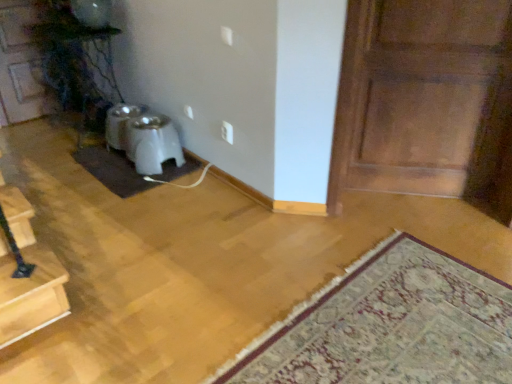
I want to click on wooden panel door at right, marked as the 1th door in a front-to-back arrangement, so click(x=422, y=97).

Image resolution: width=512 pixels, height=384 pixels. Identify the location of wooden door at upper left, which is the second door from front to back. (20, 65).

In order to click on door lying on the left of white plastic electric outlet at center in this screenshot , I will do `click(20, 65)`.

Based on the photo, between wooden door at upper left, arranged as the first door when viewed from the back, and white plastic electric outlet at center, which one has larger size?

Bigger between the two is wooden door at upper left, arranged as the first door when viewed from the back.

Does wooden door at upper left, arranged as the first door when viewed from the back, contain white plastic electric outlet at center?

Definitely not — white plastic electric outlet at center is not inside wooden door at upper left, arranged as the first door when viewed from the back.

Which is more to the left, wooden door at upper left, which is the 2th door from right to left, or white plastic electric outlet at center?

From the viewer's perspective, wooden door at upper left, which is the 2th door from right to left, appears more on the left side.

Is white plastic pet feeder at center aimed at carpeted rug at lower right?

No, white plastic pet feeder at center does not turn towards carpeted rug at lower right.

What's the angular difference between white plastic pet feeder at center and carpeted rug at lower right's facing directions?

They differ by 86.6 degrees in their facing directions.

Considering the points (130, 128) and (298, 382), which point is in front, point (130, 128) or point (298, 382)?

The point (298, 382) is closer to the camera.

Considering the relative sizes of white plastic pet feeder at center and carpeted rug at lower right in the image provided, is white plastic pet feeder at center shorter than carpeted rug at lower right?

No, white plastic pet feeder at center is not shorter than carpeted rug at lower right.

Is point (230, 125) positioned before point (183, 161)?

Yes, it is.

From the image's perspective, between white plastic electric outlet at center and white plastic pet feeder at center, which one is located above?

white plastic electric outlet at center, from the image's perspective.

Is white plastic electric outlet at center thinner than white plastic pet feeder at center?

Yes, white plastic electric outlet at center is thinner than white plastic pet feeder at center.

Can you tell me how much white plastic electric outlet at center and white plastic pet feeder at center differ in facing direction?

There is a 0.00553-degree angle between the facing directions of white plastic electric outlet at center and white plastic pet feeder at center.

From a real-world perspective, is brown felt doormat at lower left on wooden door at upper left, which is the second door from front to back?

No, from a real-world perspective, brown felt doormat at lower left is not above wooden door at upper left, which is the second door from front to back.

Does brown felt doormat at lower left turn towards wooden door at upper left, arranged as the first door when viewed from the back?

No, brown felt doormat at lower left does not turn towards wooden door at upper left, arranged as the first door when viewed from the back.

From the image's perspective, between brown felt doormat at lower left and wooden door at upper left, which is the 2th door from right to left, which one is located above?

wooden door at upper left, which is the 2th door from right to left, from the image's perspective.

Is wooden door at upper left, arranged as the first door when viewed from the back, not near carpeted rug at lower right?

Indeed, wooden door at upper left, arranged as the first door when viewed from the back, is not near carpeted rug at lower right.

Is wooden door at upper left, the 1th door from the left, taller or shorter than carpeted rug at lower right?

In the image, wooden door at upper left, the 1th door from the left, appears to be taller than carpeted rug at lower right.

Which of these two, wooden door at upper left, arranged as the first door when viewed from the back, or carpeted rug at lower right, is thinner?

Thinner between the two is wooden door at upper left, arranged as the first door when viewed from the back.

Relative to carpeted rug at lower right, is wooden door at upper left, which is the second door from front to back, in front or behind?

Clearly, wooden door at upper left, which is the second door from front to back, is behind carpeted rug at lower right.

Does carpeted rug at lower right have a greater height compared to brown felt doormat at lower left?

Incorrect, the height of carpeted rug at lower right is not larger of that of brown felt doormat at lower left.

From a real-world perspective, which is physically below, carpeted rug at lower right or brown felt doormat at lower left?

From a 3D spatial view, brown felt doormat at lower left is below.

Does carpeted rug at lower right have a lesser width compared to brown felt doormat at lower left?

Incorrect, the width of carpeted rug at lower right is not less than that of brown felt doormat at lower left.

Would you say white plastic electric outlet at center is a long distance from wooden panel door at right, marked as the 1th door in a front-to-back arrangement?

Yes, white plastic electric outlet at center and wooden panel door at right, marked as the 1th door in a front-to-back arrangement, are located far from each other.

In the scene shown: Between white plastic electric outlet at center and wooden panel door at right, marked as the 1th door in a front-to-back arrangement, which one has smaller size?

Smaller between the two is white plastic electric outlet at center.

Considering the relative sizes of white plastic electric outlet at center and wooden panel door at right, marked as the 1th door in a front-to-back arrangement, in the image provided, is white plastic electric outlet at center taller than wooden panel door at right, marked as the 1th door in a front-to-back arrangement,?

No.

Find the location of a particular element. Image resolution: width=512 pixels, height=384 pixels. electric outlet below the wooden door at upper left, the 1th door from the left (from the image's perspective) is located at coordinates (227, 132).

This screenshot has width=512, height=384. In order to click on mat below the white plastic pet feeder at center (from a real-world perspective) in this screenshot , I will do `click(389, 326)`.

Estimate the real-world distances between objects in this image. Which object is closer to white plastic electric outlet at center, wooden door at upper left, arranged as the first door when viewed from the back, or wooden panel door at right, marked as the 2th door in a back-to-front arrangement?

wooden panel door at right, marked as the 2th door in a back-to-front arrangement, lies closer to white plastic electric outlet at center than the other object.

Estimate the real-world distances between objects in this image. Which object is further from carpeted rug at lower right, brown felt doormat at lower left or wooden door at upper left, which is the second door from front to back?

wooden door at upper left, which is the second door from front to back, is further to carpeted rug at lower right.

Considering their positions, is wooden panel door at right, marked as the 2th door in a back-to-front arrangement, positioned closer to brown felt doormat at lower left than carpeted rug at lower right?

The object closer to brown felt doormat at lower left is wooden panel door at right, marked as the 2th door in a back-to-front arrangement.

From the image, which object appears to be farther from wooden door at upper left, arranged as the first door when viewed from the back, white plastic pet feeder at center or carpeted rug at lower right?

The object further to wooden door at upper left, arranged as the first door when viewed from the back, is carpeted rug at lower right.

In the scene shown: Estimate the real-world distances between objects in this image. Which object is closer to carpeted rug at lower right, wooden panel door at right, the 2th door in the left-to-right sequence, or white plastic electric outlet at center?

wooden panel door at right, the 2th door in the left-to-right sequence, lies closer to carpeted rug at lower right than the other object.

Looking at the image, which one is located further to brown felt doormat at lower left, white plastic electric outlet at center or wooden panel door at right, the 2th door in the left-to-right sequence?

wooden panel door at right, the 2th door in the left-to-right sequence, is further to brown felt doormat at lower left.

Estimate the real-world distances between objects in this image. Which object is closer to carpeted rug at lower right, white plastic pet feeder at center or white plastic electric outlet at center?

white plastic electric outlet at center is positioned closer to the anchor carpeted rug at lower right.

Looking at the image, which one is located closer to brown felt doormat at lower left, white plastic pet feeder at center or wooden panel door at right, which is the first door in right-to-left order?

white plastic pet feeder at center lies closer to brown felt doormat at lower left than the other object.

The image size is (512, 384). I want to click on wide between brown felt doormat at lower left and wooden panel door at right, the 2th door in the left-to-right sequence, in the horizontal direction, so click(x=143, y=138).

In order to click on wide between wooden door at upper left, the 1th door from the left, and carpeted rug at lower right in this screenshot , I will do `click(143, 138)`.

Image resolution: width=512 pixels, height=384 pixels. Identify the location of doormat located between carpeted rug at lower right and white plastic pet feeder at center in the depth direction. (112, 170).

The image size is (512, 384). Identify the location of mat between white plastic pet feeder at center and wooden panel door at right, marked as the 1th door in a front-to-back arrangement. (389, 326).